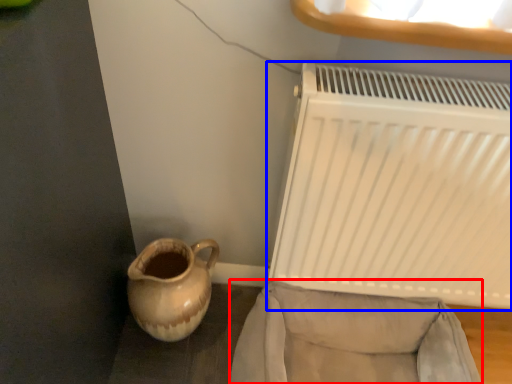
Question: Which object is closer to the camera taking this photo, armchair (highlighted by a red box) or radiator (highlighted by a blue box)?

Choices:
 (A) armchair
 (B) radiator

Answer: (B)